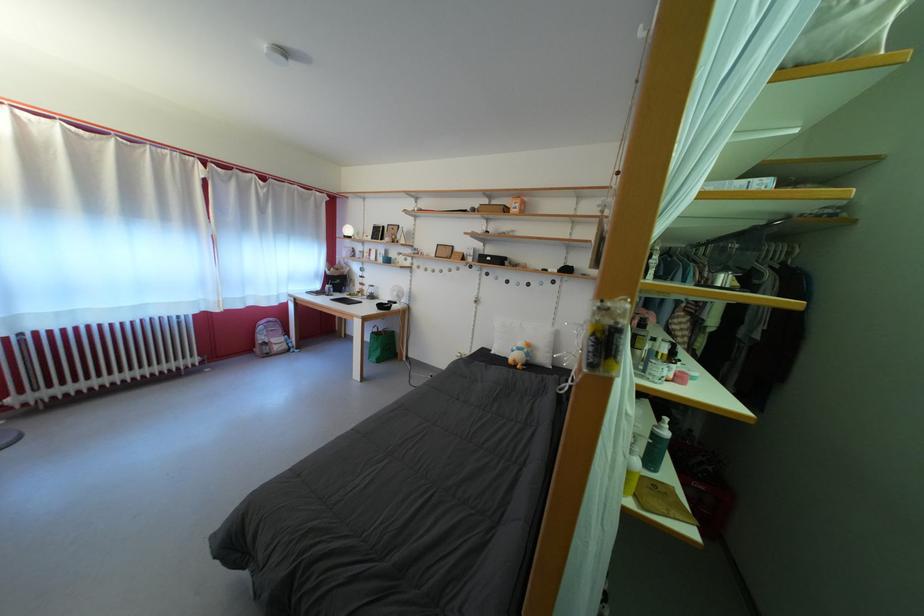
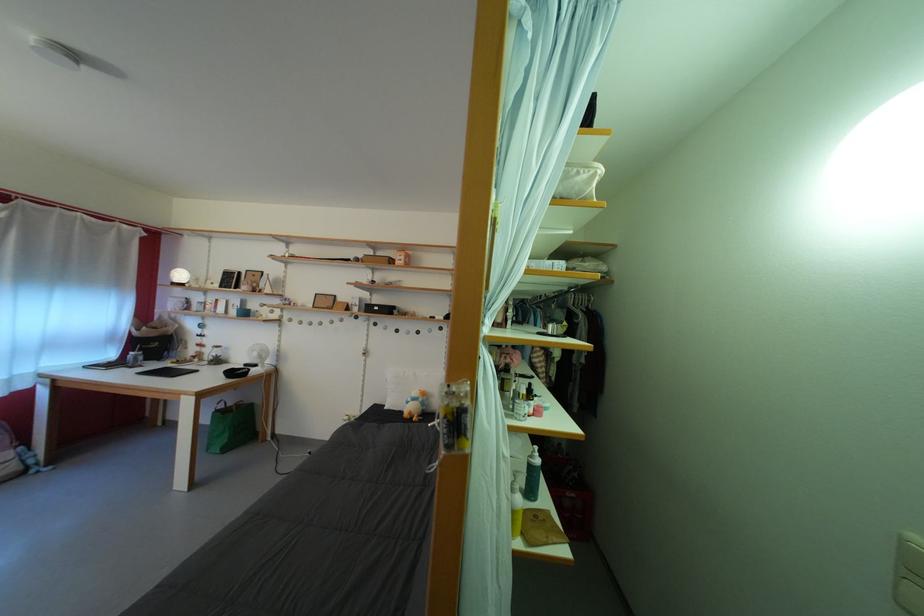
Where in the second image is the point corresponding to point 524,354 from the first image?

(418, 405)